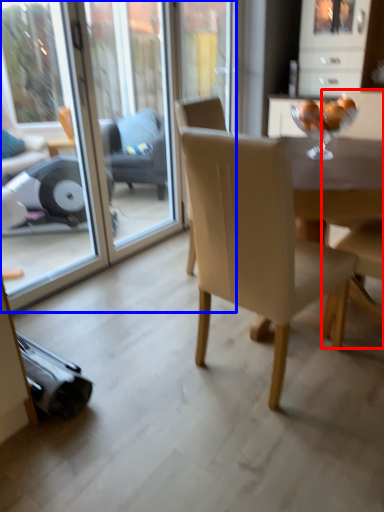
Question: Which point is closer to the camera, armchair (highlighted by a red box) or screen door (highlighted by a blue box)?

Choices:
 (A) armchair
 (B) screen door

Answer: (A)